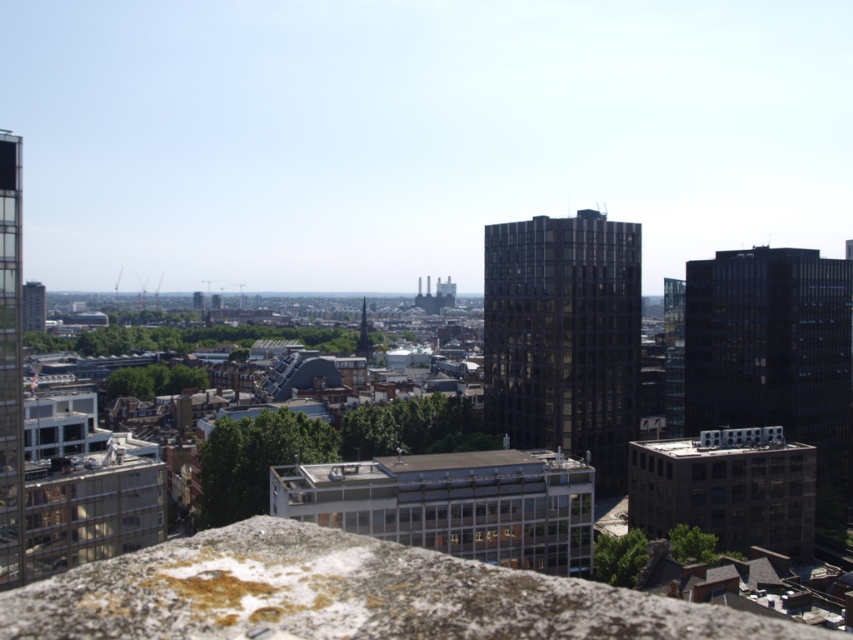
Can you confirm if dark glass building at right is bigger than matte glass tower at left?

Correct, dark glass building at right is larger in size than matte glass tower at left.

Who is positioned more to the left, dark glass building at right or matte glass tower at left?

matte glass tower at left

The image size is (853, 640). What do you see at coordinates (775, 355) in the screenshot?
I see `dark glass building at right` at bounding box center [775, 355].

You are a GUI agent. You are given a task and a screenshot of the screen. Output one action in this format:
    pyautogui.click(x=<x>, y=<y>)
    Task: Click on the dark glass building at right
    
    Given the screenshot: What is the action you would take?
    pyautogui.click(x=775, y=355)

Can you confirm if dark glass building at center is positioned above dark glass building at right?

Indeed, dark glass building at center is positioned over dark glass building at right.

What do you see at coordinates (564, 337) in the screenshot? Image resolution: width=853 pixels, height=640 pixels. I see `dark glass building at center` at bounding box center [564, 337].

The image size is (853, 640). What do you see at coordinates (564, 337) in the screenshot?
I see `dark glass building at center` at bounding box center [564, 337].

You are a GUI agent. You are given a task and a screenshot of the screen. Output one action in this format:
    pyautogui.click(x=<x>, y=<y>)
    Task: Click on the dark glass building at center
    This screenshot has height=640, width=853.
    Given the screenshot: What is the action you would take?
    pyautogui.click(x=564, y=337)

Between dark glass building at center and matte glass tower at left, which one has more height?

Standing taller between the two is dark glass building at center.

Is dark glass building at center thinner than matte glass tower at left?

No, dark glass building at center is not thinner than matte glass tower at left.

Which is behind, point (511, 280) or point (3, 396)?

The point (511, 280) is behind.

Where is `dark glass building at center`? dark glass building at center is located at coordinates (564, 337).